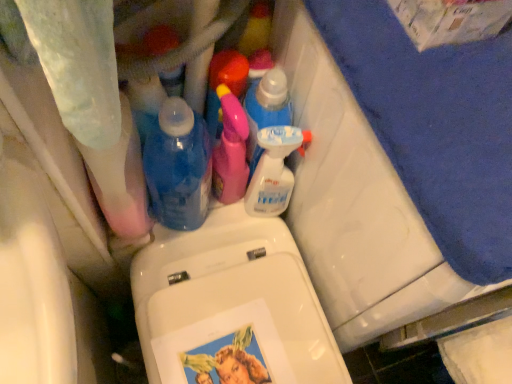
Locate an element on the screen. translucent plastic spray bottle at center, placed as the third cleaning product when sorted from left to right is located at coordinates (266, 110).

Find the location of `blue fabric bath towel at upper right`. blue fabric bath towel at upper right is located at coordinates (436, 126).

Find the location of `clear plastic spray bottle at upper center, which ranks as the first cleaning product in right-to-left order`. clear plastic spray bottle at upper center, which ranks as the first cleaning product in right-to-left order is located at coordinates (274, 170).

Who is taller, blue fabric bath towel at upper right or clear plastic spray bottle at upper center, arranged as the 4th cleaning product when viewed from the left?

blue fabric bath towel at upper right.

Is blue fabric bath towel at upper right surrounding clear plastic spray bottle at upper center, arranged as the 4th cleaning product when viewed from the left?

No, blue fabric bath towel at upper right does not contain clear plastic spray bottle at upper center, arranged as the 4th cleaning product when viewed from the left.

Considering the relative sizes of blue fabric bath towel at upper right and clear plastic spray bottle at upper center, arranged as the 4th cleaning product when viewed from the left, in the image provided, is blue fabric bath towel at upper right thinner than clear plastic spray bottle at upper center, arranged as the 4th cleaning product when viewed from the left,?

Incorrect, the width of blue fabric bath towel at upper right is not less than that of clear plastic spray bottle at upper center, arranged as the 4th cleaning product when viewed from the left.

Which is behind, blue fabric bath towel at upper right or clear plastic spray bottle at upper center, which ranks as the first cleaning product in right-to-left order?

clear plastic spray bottle at upper center, which ranks as the first cleaning product in right-to-left order, is behind.

Considering the relative sizes of pink plastic spray bottle at center, which ranks as the 4th cleaning product in right-to-left order, and pink plastic spray bottle at center, which appears as the third cleaning product when viewed from the right, in the image provided, is pink plastic spray bottle at center, which ranks as the 4th cleaning product in right-to-left order, smaller than pink plastic spray bottle at center, which appears as the third cleaning product when viewed from the right,?

Yes.

Is the surface of pink plastic spray bottle at center, positioned as the first cleaning product in left-to-right order, in direct contact with pink plastic spray bottle at center, which appears as the third cleaning product when viewed from the right?

Yes, pink plastic spray bottle at center, positioned as the first cleaning product in left-to-right order, and pink plastic spray bottle at center, which appears as the third cleaning product when viewed from the right, clearly make contact.

Is pink plastic spray bottle at center, positioned as the first cleaning product in left-to-right order, positioned before pink plastic spray bottle at center, arranged as the 2th cleaning product when viewed from the left?

No, it is not.

From a real-world perspective, is pink plastic spray bottle at center, positioned as the first cleaning product in left-to-right order, on top of pink plastic spray bottle at center, arranged as the 2th cleaning product when viewed from the left?

Actually, pink plastic spray bottle at center, positioned as the first cleaning product in left-to-right order, is physically below pink plastic spray bottle at center, arranged as the 2th cleaning product when viewed from the left, in the real world.

Which object is further away from the camera, transparent plastic bottle at center or pink plastic spray bottle at center, arranged as the 2th cleaning product when viewed from the left?

pink plastic spray bottle at center, arranged as the 2th cleaning product when viewed from the left, is further away from the camera.

Is transparent plastic bottle at center bigger or smaller than pink plastic spray bottle at center, which appears as the third cleaning product when viewed from the right?

Clearly, transparent plastic bottle at center is larger in size than pink plastic spray bottle at center, which appears as the third cleaning product when viewed from the right.

The height and width of the screenshot is (384, 512). Find the location of `bottle to the left of pink plastic spray bottle at center, arranged as the 2th cleaning product when viewed from the left`. bottle to the left of pink plastic spray bottle at center, arranged as the 2th cleaning product when viewed from the left is located at coordinates (178, 166).

Is pink plastic spray bottle at center, which appears as the third cleaning product when viewed from the right, bigger or smaller than transparent plastic bottle at center?

Considering their sizes, pink plastic spray bottle at center, which appears as the third cleaning product when viewed from the right, takes up less space than transparent plastic bottle at center.

The width and height of the screenshot is (512, 384). In order to click on the 2nd cleaning product to the right when counting from the transparent plastic bottle at center in this screenshot , I will do `click(230, 150)`.

From the picture: Relative to transparent plastic bottle at center, is pink plastic spray bottle at center, which appears as the third cleaning product when viewed from the right, in front or behind?

Visually, pink plastic spray bottle at center, which appears as the third cleaning product when viewed from the right, is located behind transparent plastic bottle at center.

Does point (225, 178) come closer to viewer compared to point (201, 178)?

No, (225, 178) is further to viewer.

Could you tell me if clear plastic spray bottle at upper center, arranged as the 4th cleaning product when viewed from the left, is facing pink plastic spray bottle at center, positioned as the first cleaning product in left-to-right order?

No.

In the scene shown: From the image's perspective, between clear plastic spray bottle at upper center, which ranks as the first cleaning product in right-to-left order, and pink plastic spray bottle at center, which ranks as the 4th cleaning product in right-to-left order, which one is located above?

pink plastic spray bottle at center, which ranks as the 4th cleaning product in right-to-left order.

Is clear plastic spray bottle at upper center, arranged as the 4th cleaning product when viewed from the left, not within pink plastic spray bottle at center, which ranks as the 4th cleaning product in right-to-left order?

Yes, clear plastic spray bottle at upper center, arranged as the 4th cleaning product when viewed from the left, is located beyond the bounds of pink plastic spray bottle at center, which ranks as the 4th cleaning product in right-to-left order.

From a real-world perspective, is clear plastic spray bottle at upper center, which ranks as the first cleaning product in right-to-left order, above or below pink plastic spray bottle at center, which ranks as the 4th cleaning product in right-to-left order?

Clearly, from a real-world perspective, clear plastic spray bottle at upper center, which ranks as the first cleaning product in right-to-left order, is below pink plastic spray bottle at center, which ranks as the 4th cleaning product in right-to-left order.

Can you confirm if transparent plastic bottle at center is taller than clear plastic spray bottle at upper center, which ranks as the first cleaning product in right-to-left order?

Indeed, transparent plastic bottle at center has a greater height compared to clear plastic spray bottle at upper center, which ranks as the first cleaning product in right-to-left order.

Is transparent plastic bottle at center to the right of clear plastic spray bottle at upper center, which ranks as the first cleaning product in right-to-left order, from the viewer's perspective?

Incorrect, transparent plastic bottle at center is not on the right side of clear plastic spray bottle at upper center, which ranks as the first cleaning product in right-to-left order.

Considering the relative sizes of transparent plastic bottle at center and clear plastic spray bottle at upper center, arranged as the 4th cleaning product when viewed from the left, in the image provided, is transparent plastic bottle at center bigger than clear plastic spray bottle at upper center, arranged as the 4th cleaning product when viewed from the left,?

Indeed, transparent plastic bottle at center has a larger size compared to clear plastic spray bottle at upper center, arranged as the 4th cleaning product when viewed from the left.

In the scene shown: From a real-world perspective, is transparent plastic bottle at center under clear plastic spray bottle at upper center, which ranks as the first cleaning product in right-to-left order?

Actually, transparent plastic bottle at center is physically above clear plastic spray bottle at upper center, which ranks as the first cleaning product in right-to-left order, in the real world.

In the scene shown: Who is more distant, blue fabric bath towel at upper right or transparent plastic bottle at center?

transparent plastic bottle at center.

Considering the sizes of blue fabric bath towel at upper right and transparent plastic bottle at center in the image, is blue fabric bath towel at upper right taller or shorter than transparent plastic bottle at center?

blue fabric bath towel at upper right is taller than transparent plastic bottle at center.

Can you tell me how much blue fabric bath towel at upper right and transparent plastic bottle at center differ in facing direction?

They differ by 0.274 degrees in their facing directions.

From the image's perspective, is blue fabric bath towel at upper right on transparent plastic bottle at center?

Incorrect, from the image's perspective, blue fabric bath towel at upper right is lower than transparent plastic bottle at center.

In order to click on bath towel that is in front of the clear plastic spray bottle at upper center, which ranks as the first cleaning product in right-to-left order in this screenshot , I will do `click(436, 126)`.

The height and width of the screenshot is (384, 512). Identify the location of cleaning product to the left of pink plastic spray bottle at center, arranged as the 2th cleaning product when viewed from the left. (225, 85).

Estimate the real-world distances between objects in this image. Which object is further from pink plastic spray bottle at center, positioned as the first cleaning product in left-to-right order, clear plastic spray bottle at upper center, arranged as the 4th cleaning product when viewed from the left, or transparent plastic bottle at center?

Among the two, clear plastic spray bottle at upper center, arranged as the 4th cleaning product when viewed from the left, is located further to pink plastic spray bottle at center, positioned as the first cleaning product in left-to-right order.

From the image, which object appears to be nearer to pink plastic spray bottle at center, positioned as the first cleaning product in left-to-right order, translucent plastic spray bottle at center, placed as the third cleaning product when sorted from left to right, or pink plastic spray bottle at center, arranged as the 2th cleaning product when viewed from the left?

Among the two, translucent plastic spray bottle at center, placed as the third cleaning product when sorted from left to right, is located nearer to pink plastic spray bottle at center, positioned as the first cleaning product in left-to-right order.

Which object lies nearer to the anchor point pink plastic spray bottle at center, which appears as the third cleaning product when viewed from the right, transparent plastic bottle at center or translucent plastic spray bottle at center, marked as the 2th cleaning product in a right-to-left arrangement?

Based on the image, translucent plastic spray bottle at center, marked as the 2th cleaning product in a right-to-left arrangement, appears to be nearer to pink plastic spray bottle at center, which appears as the third cleaning product when viewed from the right.

From the image, which object appears to be farther from transparent plastic bottle at center, translucent plastic spray bottle at center, placed as the third cleaning product when sorted from left to right, or pink plastic spray bottle at center, which appears as the third cleaning product when viewed from the right?

translucent plastic spray bottle at center, placed as the third cleaning product when sorted from left to right.

In the scene shown: Looking at the image, which one is located further to transparent plastic bottle at center, pink plastic spray bottle at center, positioned as the first cleaning product in left-to-right order, or translucent plastic spray bottle at center, placed as the third cleaning product when sorted from left to right?

translucent plastic spray bottle at center, placed as the third cleaning product when sorted from left to right, is further to transparent plastic bottle at center.

From the image, which object appears to be farther from clear plastic spray bottle at upper center, arranged as the 4th cleaning product when viewed from the left, pink plastic spray bottle at center, arranged as the 2th cleaning product when viewed from the left, or pink plastic spray bottle at center, positioned as the first cleaning product in left-to-right order?

pink plastic spray bottle at center, positioned as the first cleaning product in left-to-right order, is further to clear plastic spray bottle at upper center, arranged as the 4th cleaning product when viewed from the left.

From the picture: When comparing their distances from translucent plastic spray bottle at center, placed as the third cleaning product when sorted from left to right, does transparent plastic bottle at center or pink plastic spray bottle at center, arranged as the 2th cleaning product when viewed from the left, seem further?

The object further to translucent plastic spray bottle at center, placed as the third cleaning product when sorted from left to right, is transparent plastic bottle at center.

Looking at the image, which one is located closer to transparent plastic bottle at center, clear plastic spray bottle at upper center, which ranks as the first cleaning product in right-to-left order, or pink plastic spray bottle at center, which ranks as the 4th cleaning product in right-to-left order?

pink plastic spray bottle at center, which ranks as the 4th cleaning product in right-to-left order.

Where is `cleaning product between pink plastic spray bottle at center, positioned as the first cleaning product in left-to-right order, and translucent plastic spray bottle at center, marked as the 2th cleaning product in a right-to-left arrangement, from left to right`? This screenshot has height=384, width=512. cleaning product between pink plastic spray bottle at center, positioned as the first cleaning product in left-to-right order, and translucent plastic spray bottle at center, marked as the 2th cleaning product in a right-to-left arrangement, from left to right is located at coordinates (230, 150).

What are the coordinates of `cleaning product situated between translucent plastic spray bottle at center, placed as the third cleaning product when sorted from left to right, and blue fabric bath towel at upper right from left to right` in the screenshot? It's located at (274, 170).

Find the location of a particular element. The width and height of the screenshot is (512, 384). cleaning product between translucent plastic spray bottle at center, marked as the 2th cleaning product in a right-to-left arrangement, and clear plastic spray bottle at upper center, which ranks as the first cleaning product in right-to-left order, from top to bottom is located at coordinates (230, 150).